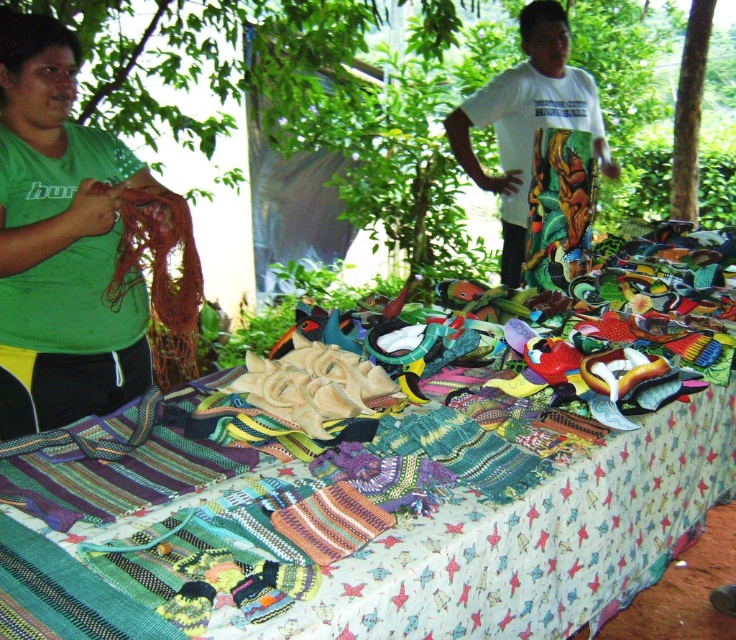
Looking at this image, can you confirm if textile bags at center is positioned above white printed t-shirt at upper right?

No, textile bags at center is not above white printed t-shirt at upper right.

Which is more to the right, textile bags at center or white printed t-shirt at upper right?

white printed t-shirt at upper right is more to the right.

Is point (336, 472) farther from viewer compared to point (506, 182)?

No, (336, 472) is in front of (506, 182).

This screenshot has width=736, height=640. In order to click on textile bags at center in this screenshot , I will do `click(386, 484)`.

This screenshot has height=640, width=736. I want to click on green matte shirt at left, so click(60, 243).

Is green matte shirt at left below white printed t-shirt at upper right?

Yes, green matte shirt at left is below white printed t-shirt at upper right.

Does point (35, 337) come in front of point (506, 109)?

Yes, point (35, 337) is closer to viewer.

What are the coordinates of `green matte shirt at left` in the screenshot? It's located at (60, 243).

Can you confirm if textile bags at center is thinner than green matte shirt at left?

In fact, textile bags at center might be wider than green matte shirt at left.

Does point (481, 429) lie behind point (77, 372)?

That is False.

Identify the location of textile bags at center. (386, 484).